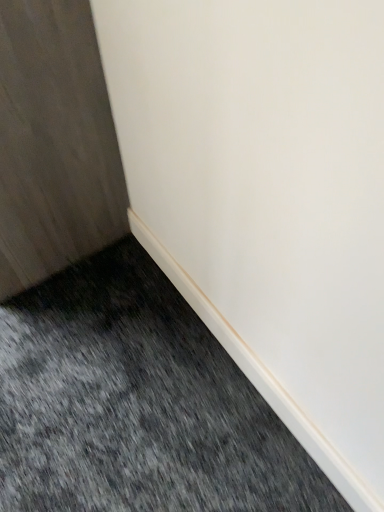
In order to click on gray carpet at lower left in this screenshot , I will do `click(136, 404)`.

What do you see at coordinates (136, 404) in the screenshot?
I see `gray carpet at lower left` at bounding box center [136, 404].

The height and width of the screenshot is (512, 384). I want to click on gray carpet at lower left, so click(136, 404).